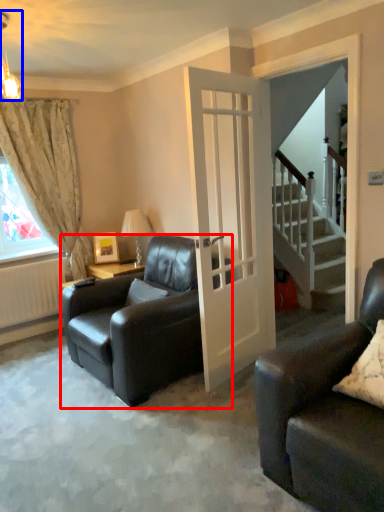
Question: Which point is further to the camera, chair (highlighted by a red box) or light fixture (highlighted by a blue box)?

Choices:
 (A) chair
 (B) light fixture

Answer: (A)